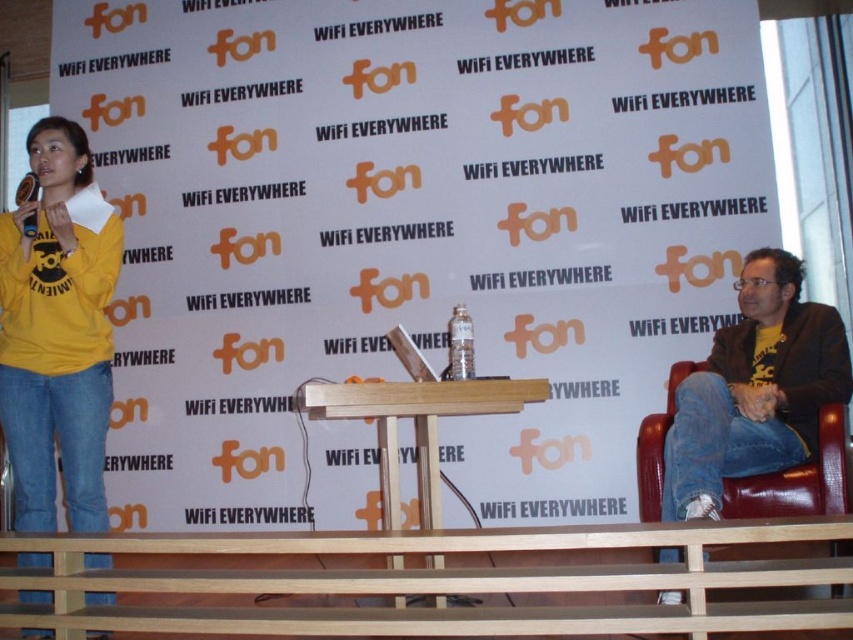
Who is lower down, yellow cotton sweatshirt at left or leather at right?

Positioned lower is leather at right.

Between point (68, 396) and point (677, 380), which one is positioned behind?

The point (677, 380) is more distant.

Where is `yellow cotton sweatshirt at left`? This screenshot has width=853, height=640. yellow cotton sweatshirt at left is located at coordinates (57, 333).

Where is `yellow cotton sweatshirt at left`? This screenshot has width=853, height=640. yellow cotton sweatshirt at left is located at coordinates (57, 333).

In the scene shown: Is wooden at center wider than leather at right?

Yes.

Does point (309, 410) come in front of point (844, 442)?

No, (309, 410) is further to viewer.

Which is behind, point (424, 456) or point (761, 480)?

The point (424, 456) is behind.

This screenshot has height=640, width=853. Identify the location of wooden at center. (415, 426).

Who is shorter, yellow cotton sweatshirt at left or wooden at center?

Standing shorter between the two is wooden at center.

Does yellow cotton sweatshirt at left lie behind wooden at center?

Yes.

Is point (6, 276) less distant than point (380, 403)?

No, (6, 276) is further to viewer.

The height and width of the screenshot is (640, 853). I want to click on yellow cotton sweatshirt at left, so click(x=57, y=333).